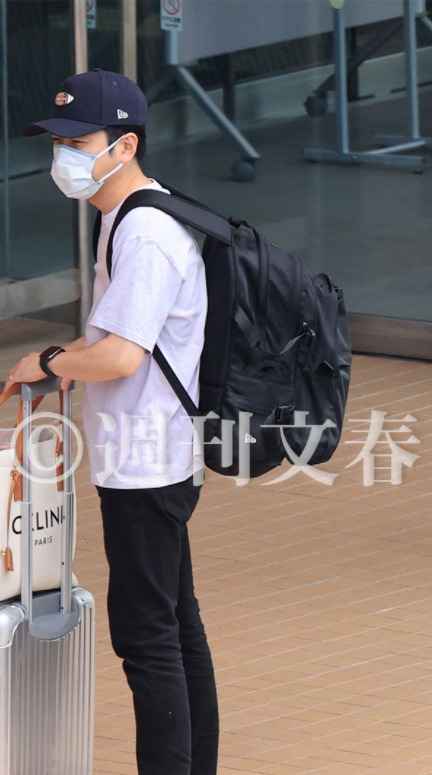
You are a GUI agent. You are given a task and a screenshot of the screen. Output one action in this format:
    pyautogui.click(x=<x>, y=<y>)
    Task: Click on the floor
    Image resolution: width=432 pixels, height=775 pixels.
    Given the screenshot: What is the action you would take?
    pyautogui.click(x=333, y=181)